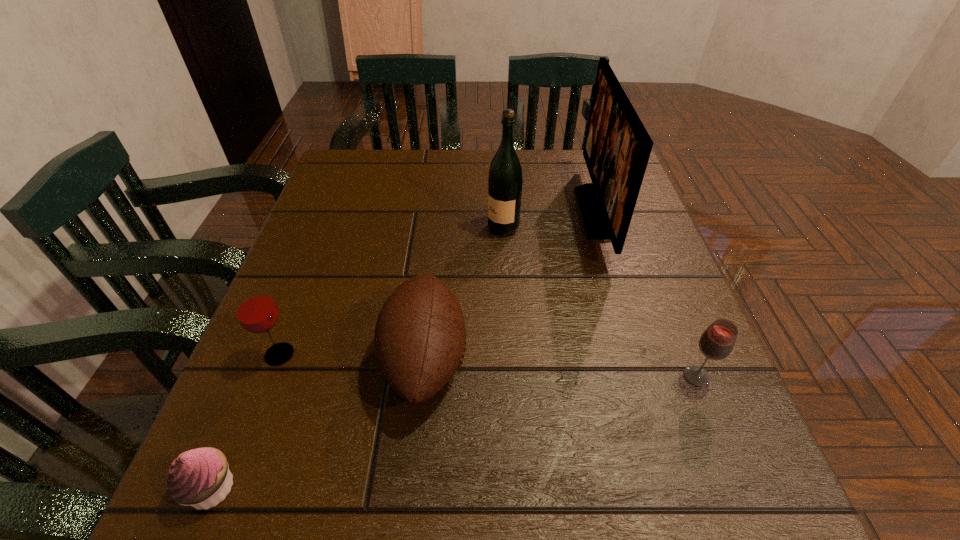
Locate an element on the screen. The image size is (960, 540). the fifth object from left to right is located at coordinates (617, 147).

This screenshot has height=540, width=960. Identify the location of liquor. (505, 179).

Locate an element on the screen. This screenshot has height=540, width=960. the left glass drink container is located at coordinates (256, 311).

The height and width of the screenshot is (540, 960). I want to click on football, so click(x=420, y=338).

Locate an element on the screen. The width and height of the screenshot is (960, 540). the shorter glass drink container is located at coordinates (716, 343).

Identify the location of the rightmost object. (716, 343).

What are the coordinates of `the nearest object` in the screenshot? It's located at [x=200, y=477].

The width and height of the screenshot is (960, 540). Identify the location of cupcake. (200, 477).

Where is `vacant region located on the front-facing side of the monitor`? vacant region located on the front-facing side of the monitor is located at coordinates (460, 212).

This screenshot has height=540, width=960. In order to click on vacant space located on the front-facing side of the monitor in this screenshot , I will do `click(447, 212)`.